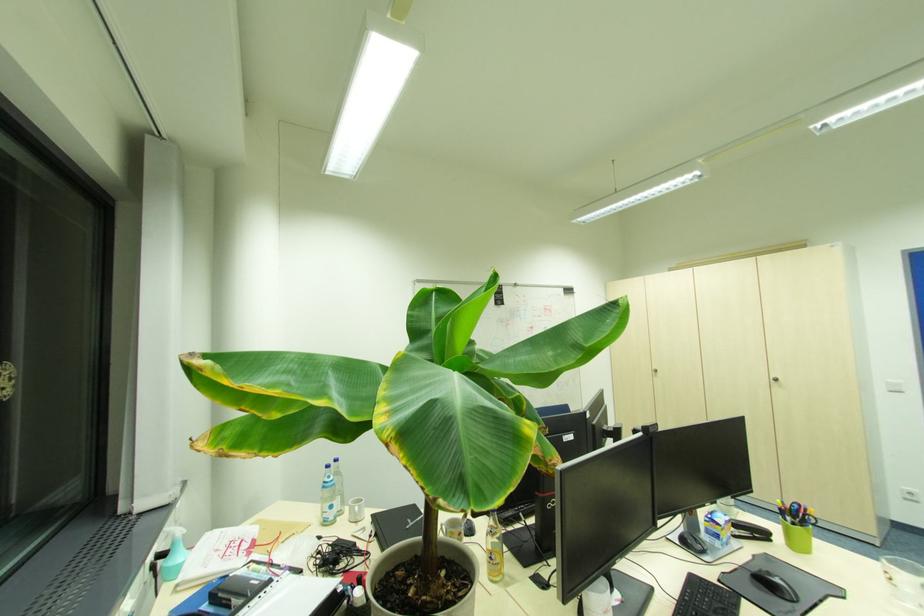
The image size is (924, 616). In order to click on silver cabinet handle in this screenshot , I will do `click(774, 379)`.